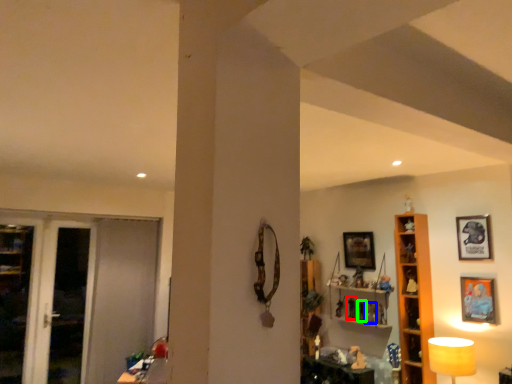
Question: Which object is the closest to the toy (highlighted by a red box)? Choose among these: toy (highlighted by a blue box) or toy (highlighted by a green box).

Choices:
 (A) toy
 (B) toy

Answer: (B)